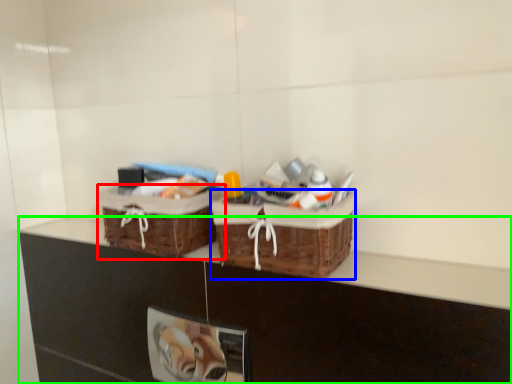
Question: Estimate the real-world distances between objects in this image. Which object is farther from picnic basket (highlighted by a red box), picnic basket (highlighted by a blue box) or counter (highlighted by a green box)?

Choices:
 (A) picnic basket
 (B) counter

Answer: (A)